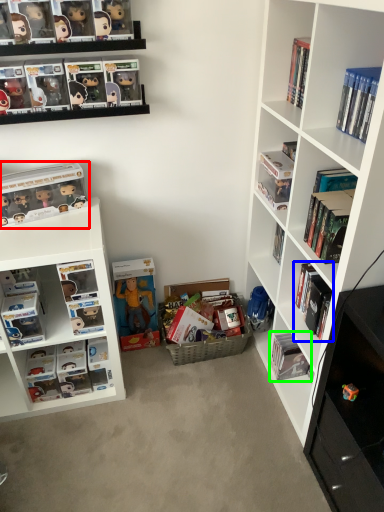
Question: Which is farther away from book (highlighted by a red box)? book (highlighted by a blue box) or book (highlighted by a green box)?

Choices:
 (A) book
 (B) book

Answer: (B)